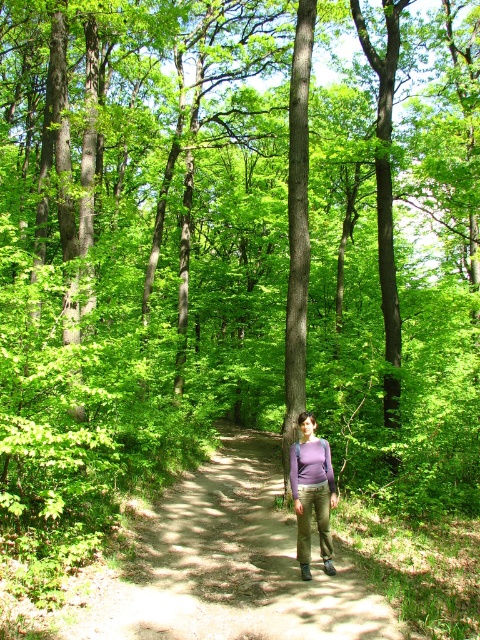
Is purple matte shirt at center positioned before purple matte sweatshirt at center?

No, purple matte shirt at center is further to the viewer.

Is point (307, 540) positioned after point (294, 481)?

Yes, it is behind point (294, 481).

This screenshot has width=480, height=640. I want to click on purple matte shirt at center, so pos(312,492).

Can you confirm if dirt path at center is positioned above purple matte shirt at center?

No.

Is dirt path at center to the left of purple matte shirt at center from the viewer's perspective?

Yes, dirt path at center is to the left of purple matte shirt at center.

Who is more forward, (256, 620) or (308, 477)?

Point (256, 620)

Locate an element on the screen. dirt path at center is located at coordinates (226, 564).

Between point (276, 454) and point (290, 465), which one is positioned in front?

Positioned in front is point (290, 465).

Can you confirm if dirt path at center is positioned above purple matte sweatshirt at center?

No.

Is point (368, 637) positioned before point (311, 474)?

Yes, point (368, 637) is in front of point (311, 474).

Identify the location of dirt path at center. (226, 564).